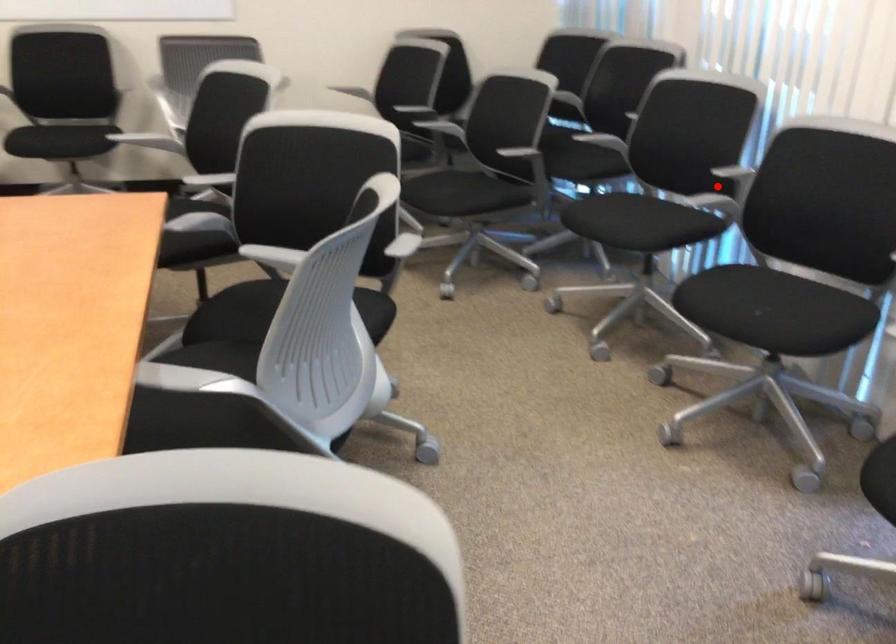
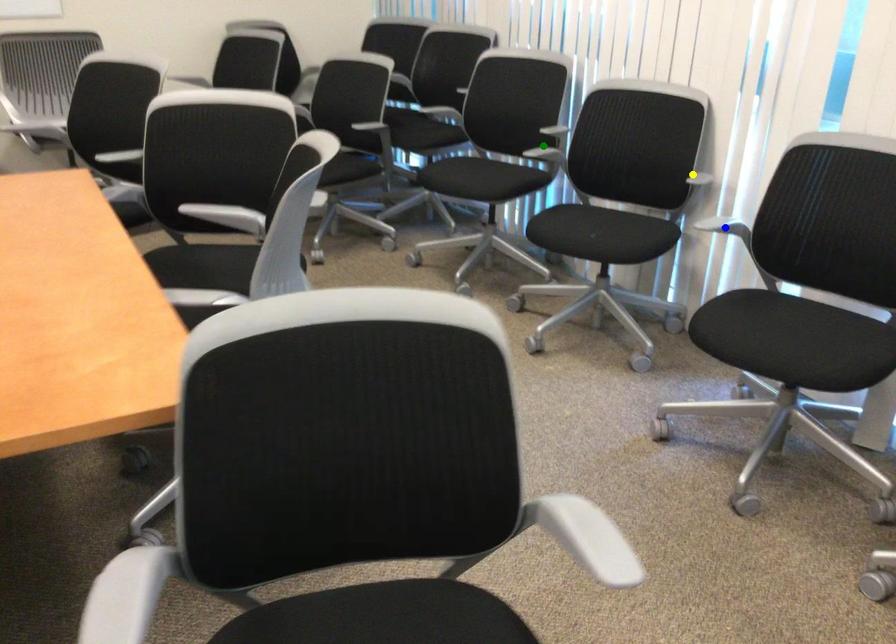
Question: I am providing you with two images of the same scene from different viewpoints. A red point is marked on the first image. You are given multiple points on the second image. Which point in image 2 represents the same 3d spot as the red point in image 1?

Choices:
 (A) yellow point
 (B) blue point
 (C) green point

Answer: (C)